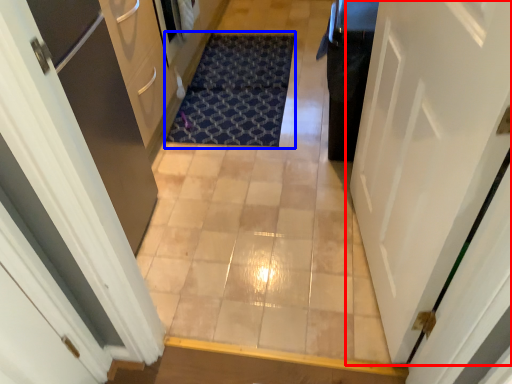
Question: Which object appears farthest to the camera in this image, door (highlighted by a red box) or doormat (highlighted by a blue box)?

Choices:
 (A) door
 (B) doormat

Answer: (B)